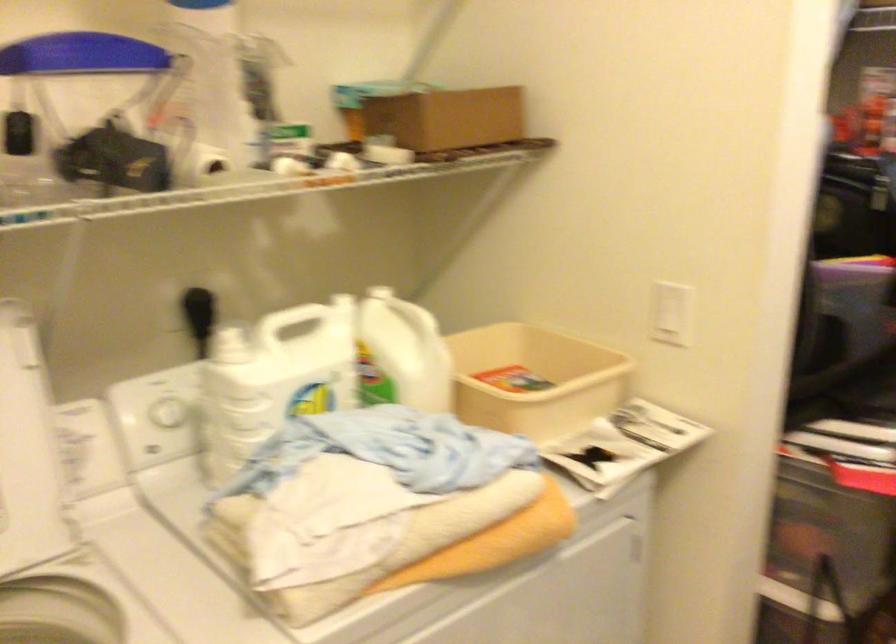
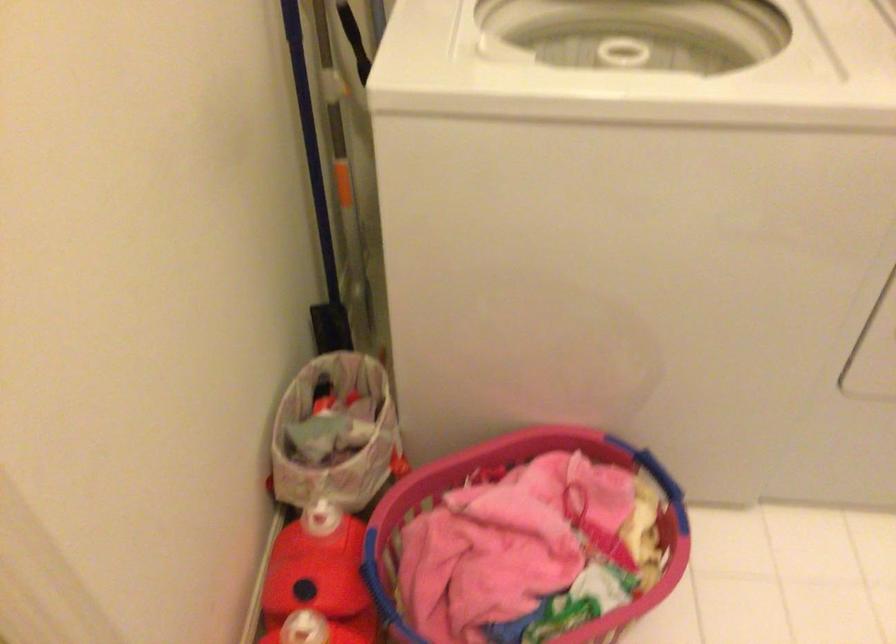
Based on the continuous images, in which direction is the camera rotating?

The camera's rotation is toward left-down.